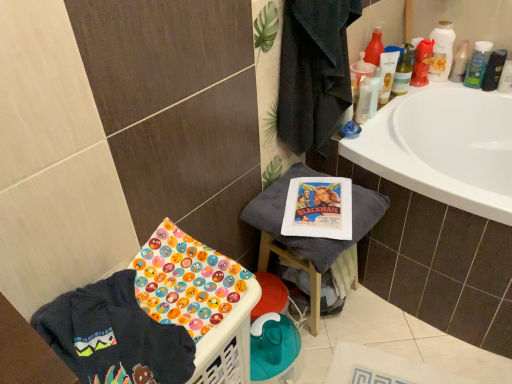
Question: From a real-world perspective, is green plastic mouthwash at upper right, which is the 5th mouthwash from left to right, over white plastic mouthwash at upper right, the sixth mouthwash from the right?

Choices:
 (A) yes
 (B) no

Answer: (A)

Question: Is green plastic mouthwash at upper right, the 2th mouthwash viewed from the right, further to camera compared to white plastic mouthwash at upper right, the sixth mouthwash from the right?

Choices:
 (A) yes
 (B) no

Answer: (A)

Question: Does green plastic mouthwash at upper right, which is the 5th mouthwash from left to right, come in front of white plastic mouthwash at upper right, marked as the 1th mouthwash in a left-to-right arrangement?

Choices:
 (A) yes
 (B) no

Answer: (B)

Question: Is green plastic mouthwash at upper right, which is the 5th mouthwash from left to right, oriented away from white plastic mouthwash at upper right, marked as the 1th mouthwash in a left-to-right arrangement?

Choices:
 (A) no
 (B) yes

Answer: (A)

Question: From a real-world perspective, is green plastic mouthwash at upper right, the 2th mouthwash viewed from the right, located beneath white plastic mouthwash at upper right, the sixth mouthwash from the right?

Choices:
 (A) no
 (B) yes

Answer: (A)

Question: Considering the positions of green plastic mouthwash at upper right, which is the 5th mouthwash from left to right, and translucent plastic mouthwash at upper right, the second mouthwash when ordered from left to right, in the image, is green plastic mouthwash at upper right, which is the 5th mouthwash from left to right, bigger or smaller than translucent plastic mouthwash at upper right, the second mouthwash when ordered from left to right,?

Choices:
 (A) big
 (B) small

Answer: (A)

Question: In the image, is green plastic mouthwash at upper right, which is the 5th mouthwash from left to right, positioned in front of or behind translucent plastic mouthwash at upper right, the fifth mouthwash positioned from the right?

Choices:
 (A) front
 (B) behind

Answer: (B)

Question: From the image's perspective, relative to translucent plastic mouthwash at upper right, the second mouthwash when ordered from left to right, is green plastic mouthwash at upper right, which is the 5th mouthwash from left to right, above or below?

Choices:
 (A) above
 (B) below

Answer: (A)

Question: From a real-world perspective, is green plastic mouthwash at upper right, the 2th mouthwash viewed from the right, positioned above or below translucent plastic mouthwash at upper right, the fifth mouthwash positioned from the right?

Choices:
 (A) above
 (B) below

Answer: (B)

Question: Is point (257, 200) positioned closer to the camera than point (456, 69)?

Choices:
 (A) farther
 (B) closer

Answer: (B)

Question: Is white cotton towel at center in front of or behind translucent plastic bottle at upper right in the image?

Choices:
 (A) front
 (B) behind

Answer: (A)

Question: From the image's perspective, is white cotton towel at center positioned above or below translucent plastic bottle at upper right?

Choices:
 (A) above
 (B) below

Answer: (B)

Question: From a real-world perspective, is white cotton towel at center physically located above or below translucent plastic bottle at upper right?

Choices:
 (A) below
 (B) above

Answer: (A)

Question: Is translucent plastic mouthwash at upper right, arranged as the third mouthwash when viewed from the right, bigger or smaller than green plastic mouthwash at upper right, the 2th mouthwash viewed from the right?

Choices:
 (A) big
 (B) small

Answer: (A)

Question: Considering the positions of translucent plastic mouthwash at upper right, acting as the 4th mouthwash starting from the left, and green plastic mouthwash at upper right, the 2th mouthwash viewed from the right, in the image, is translucent plastic mouthwash at upper right, acting as the 4th mouthwash starting from the left, taller or shorter than green plastic mouthwash at upper right, the 2th mouthwash viewed from the right,?

Choices:
 (A) tall
 (B) short

Answer: (A)